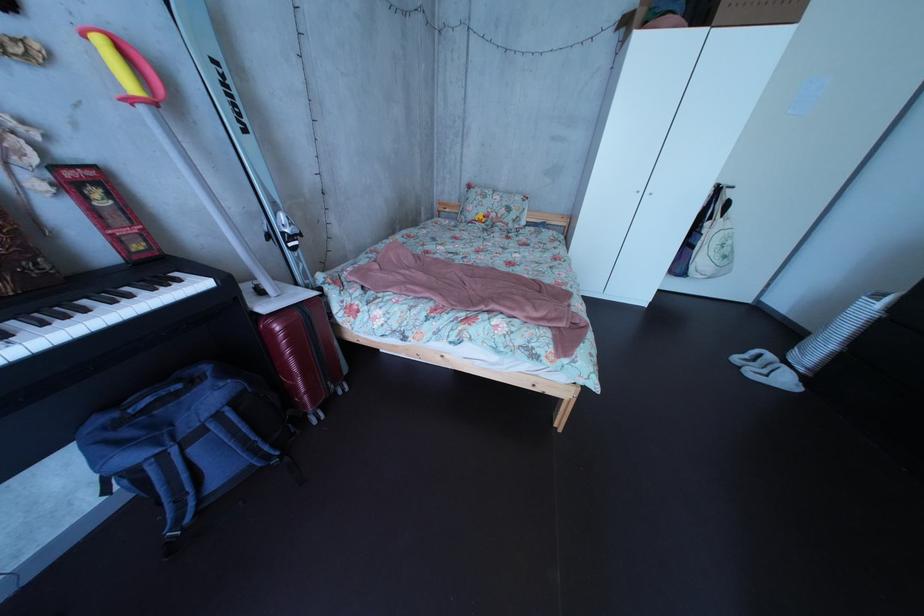
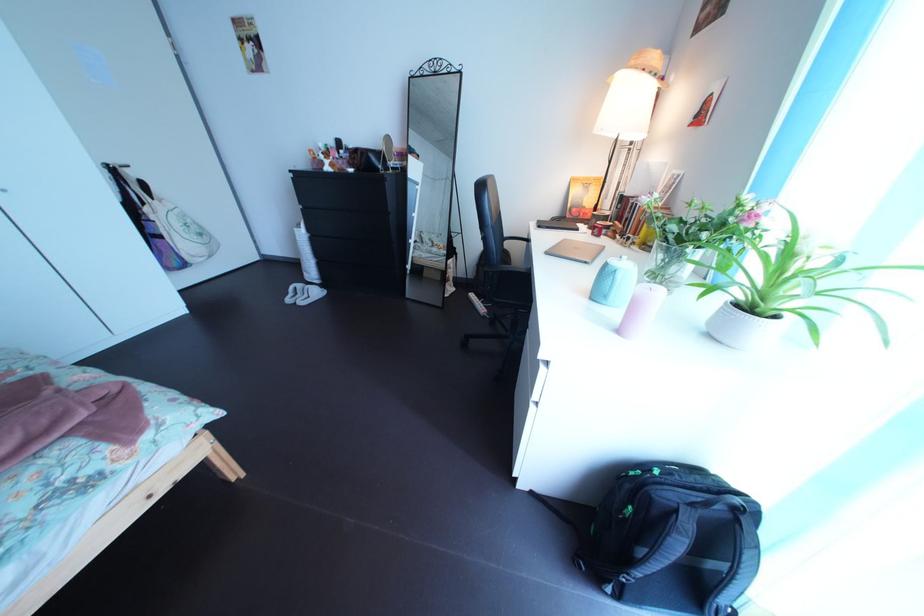
In the second image, find the point that corresponds to the point at 740,257 in the first image.

(209, 237)